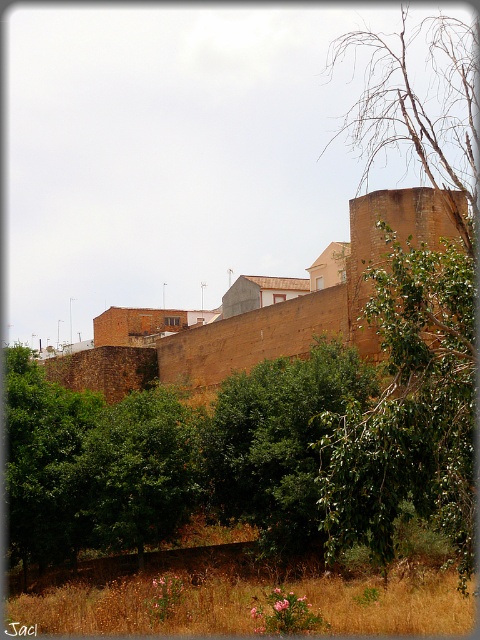
Does green leafy tree at right have a larger size compared to green leafy tree at center?

Yes.

Who is more distant from viewer, (464, 342) or (226, 504)?

The point (226, 504) is behind.

Is point (442, 451) closer to viewer compared to point (235, 440)?

That is True.

Where is `green leafy tree at right`? The width and height of the screenshot is (480, 640). green leafy tree at right is located at coordinates (408, 410).